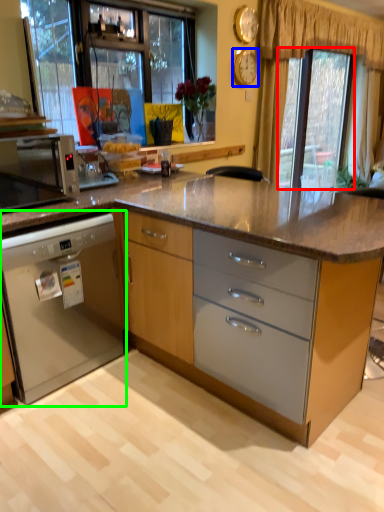
Question: Which is farther away from window screen (highlighted by a red box)? clock (highlighted by a blue box) or cabinetry (highlighted by a green box)?

Choices:
 (A) clock
 (B) cabinetry

Answer: (B)